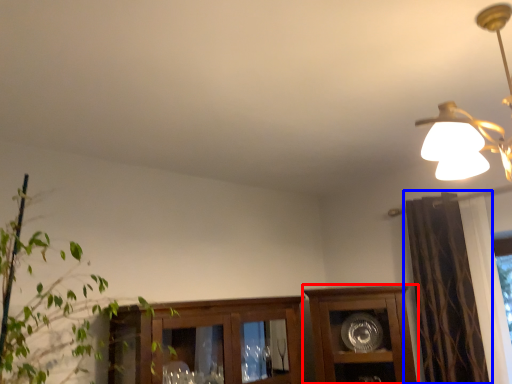
Question: Which of the following is the closest to the observer, cabinetry (highlighted by a red box) or curtain (highlighted by a blue box)?

Choices:
 (A) cabinetry
 (B) curtain

Answer: (B)